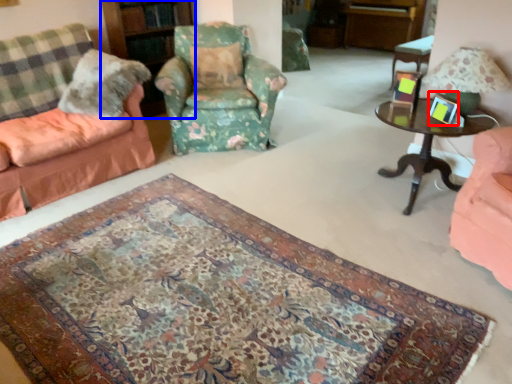
Question: Which point is closer to the camera, picture frame (highlighted by a red box) or bookshelf (highlighted by a blue box)?

Choices:
 (A) picture frame
 (B) bookshelf

Answer: (A)